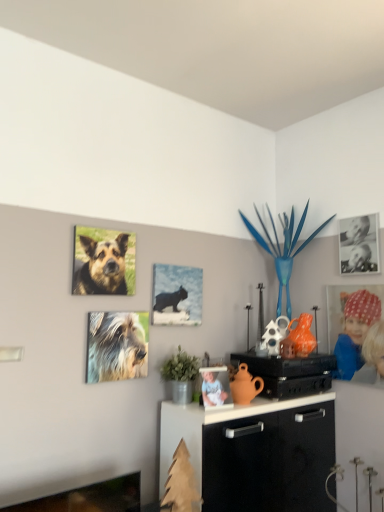
Find the location of a particular element. The height and width of the screenshot is (512, 384). brown fur dog at upper left, positioned as the second dog in bottom-to-top order is located at coordinates (102, 267).

How much space does brown fur dog at upper left, positioned as the second dog in bottom-to-top order, occupy vertically?

brown fur dog at upper left, positioned as the second dog in bottom-to-top order, is 12.17 inches tall.

What do you see at coordinates (289, 373) in the screenshot? I see `matte black speaker at center` at bounding box center [289, 373].

Measure the distance between point (187,306) and camera.

The depth of point (187,306) is 2.19 meters.

What do you see at coordinates (357, 332) in the screenshot? I see `polka dot fabric headband at right, positioned as the 1th person in back-to-front order` at bounding box center [357, 332].

This screenshot has height=512, width=384. In order to click on black paper photo at upper right, which ranks as the second picture frame in bottom-to-top order in this screenshot , I will do `click(359, 245)`.

Locate an element on the screen. This screenshot has width=384, height=512. brown fur dog at upper left, marked as the 1th dog in a top-to-bottom arrangement is located at coordinates (102, 267).

Is white porcelain figurine at center, the second person in the back-to-front sequence, far from metallic blue plant at upper center?

That's not correct — white porcelain figurine at center, the second person in the back-to-front sequence, is a little close to metallic blue plant at upper center.

Does point (203, 392) come farther from viewer compared to point (293, 255)?

No.

Consider the image. Considering the relative positions of white porcelain figurine at center, the first person from the left, and metallic blue plant at upper center in the image provided, is white porcelain figurine at center, the first person from the left, to the left or to the right of metallic blue plant at upper center?

white porcelain figurine at center, the first person from the left, is to the left of metallic blue plant at upper center.

From the image's perspective, is white porcelain figurine at center, the first person from the left, beneath metallic blue plant at upper center?

Yes.

Is point (241, 213) positioned behind point (284, 383)?

Yes, it is.

Which object is thinner, metallic blue plant at upper center or matte black speaker at center?

matte black speaker at center.

In terms of height, does metallic blue plant at upper center look taller or shorter compared to matte black speaker at center?

metallic blue plant at upper center is taller than matte black speaker at center.

From the picture: Is matte black cat at center, which is counted as the 1th picture frame, starting from the bottom, taller or shorter than black paper photo at upper right, marked as the first picture frame in a top-to-bottom arrangement?

In the image, matte black cat at center, which is counted as the 1th picture frame, starting from the bottom, appears to be shorter than black paper photo at upper right, marked as the first picture frame in a top-to-bottom arrangement.

Which is more to the left, matte black cat at center, which is the 2th picture frame in right-to-left order, or black paper photo at upper right, which ranks as the second picture frame in bottom-to-top order?

matte black cat at center, which is the 2th picture frame in right-to-left order, is more to the left.

Where is `picture frame above the matte black cat at center, positioned as the first picture frame in left-to-right order (from a real-world perspective)`? picture frame above the matte black cat at center, positioned as the first picture frame in left-to-right order (from a real-world perspective) is located at coordinates (359, 245).

Considering the relative positions of matte black speaker at center and fuzzy fur dog at upper left, the 1th dog positioned from the bottom, in the image provided, is matte black speaker at center in front of fuzzy fur dog at upper left, the 1th dog positioned from the bottom,?

No.

In terms of width, does matte black speaker at center look wider or thinner when compared to fuzzy fur dog at upper left, the 1th dog positioned from the bottom?

Considering their sizes, matte black speaker at center looks broader than fuzzy fur dog at upper left, the 1th dog positioned from the bottom.

From a real-world perspective, is matte black speaker at center positioned under fuzzy fur dog at upper left, the 1th dog positioned from the bottom, based on gravity?

Yes, from a real-world perspective, matte black speaker at center is below fuzzy fur dog at upper left, the 1th dog positioned from the bottom.

Based on the photo, from a real-world perspective, which object stands above the other?

fuzzy fur dog at upper left, the 2th dog positioned from the top, from a real-world perspective.

Between fuzzy fur dog at upper left, the 1th dog positioned from the bottom, and white porcelain figurine at center, the 1th person in the front-to-back sequence, which one appears on the right side from the viewer's perspective?

Positioned to the right is white porcelain figurine at center, the 1th person in the front-to-back sequence.

Does fuzzy fur dog at upper left, the 2th dog positioned from the top, come behind white porcelain figurine at center, the second person in the back-to-front sequence?

No.

Which point is more distant from viewer, (94, 286) or (208, 400)?

The point (94, 286) is farther.

You are a GUI agent. You are given a task and a screenshot of the screen. Output one action in this format:
    pyautogui.click(x=<x>, y=<y>)
    Task: Click on the person that is the 2nd one below the brown fur dog at upper left, positioned as the second dog in bottom-to-top order (from a real-world perspective)
    This screenshot has width=384, height=512.
    Given the screenshot: What is the action you would take?
    pyautogui.click(x=212, y=389)

In terms of width, does brown fur dog at upper left, marked as the 1th dog in a top-to-bottom arrangement, look wider or thinner when compared to white porcelain figurine at center, the 1th person in the front-to-back sequence?

brown fur dog at upper left, marked as the 1th dog in a top-to-bottom arrangement, is thinner than white porcelain figurine at center, the 1th person in the front-to-back sequence.

Can white porcelain figurine at center, the second person in the back-to-front sequence, be found inside brown fur dog at upper left, marked as the 1th dog in a top-to-bottom arrangement?

No, white porcelain figurine at center, the second person in the back-to-front sequence, is located outside of brown fur dog at upper left, marked as the 1th dog in a top-to-bottom arrangement.

Who is shorter, polka dot fabric headband at right, positioned as the 1th person in back-to-front order, or black paper photo at upper right, which ranks as the second picture frame in bottom-to-top order?

With less height is black paper photo at upper right, which ranks as the second picture frame in bottom-to-top order.

Is polka dot fabric headband at right, which is the first person in right-to-left order, facing away from black paper photo at upper right, which ranks as the second picture frame in bottom-to-top order?

polka dot fabric headband at right, which is the first person in right-to-left order, does not have its back to black paper photo at upper right, which ranks as the second picture frame in bottom-to-top order.

What are the coordinates of `person that is the 1st one when counting leftward from the black paper photo at upper right, which ranks as the second picture frame in bottom-to-top order` in the screenshot? It's located at (357, 332).

Between polka dot fabric headband at right, positioned as the 1th person in back-to-front order, and black paper photo at upper right, which is the first picture frame from right to left, which one has larger width?

With larger width is polka dot fabric headband at right, positioned as the 1th person in back-to-front order.

There is a metallic blue plant at upper center. Identify the location of the 2nd person below it (from a real-world perspective). The width and height of the screenshot is (384, 512). (212, 389).

Where is `appliance below the metallic blue plant at upper center (from the image's perspective)`? The image size is (384, 512). appliance below the metallic blue plant at upper center (from the image's perspective) is located at coordinates (289, 373).

When comparing their distances from matte black cat at center, which is the 2th picture frame in right-to-left order, does fuzzy fur dog at upper left, the 2th dog positioned from the top, or brown fur dog at upper left, marked as the 1th dog in a top-to-bottom arrangement, seem further?

brown fur dog at upper left, marked as the 1th dog in a top-to-bottom arrangement, lies further to matte black cat at center, which is the 2th picture frame in right-to-left order, than the other object.

Estimate the real-world distances between objects in this image. Which object is further from metallic blue plant at upper center, matte black cat at center, which is counted as the 1th picture frame, starting from the bottom, or white porcelain figurine at center, the 1th person in the front-to-back sequence?

white porcelain figurine at center, the 1th person in the front-to-back sequence, is positioned further to the anchor metallic blue plant at upper center.

Looking at the image, which one is located further to fuzzy fur dog at upper left, the 1th dog positioned from the bottom, matte black speaker at center or matte black cat at center, which appears as the second picture frame when viewed from the top?

matte black speaker at center is further to fuzzy fur dog at upper left, the 1th dog positioned from the bottom.

Which object lies nearer to the anchor point matte black cat at center, which appears as the second picture frame when viewed from the top, metallic blue plant at upper center or brown fur dog at upper left, marked as the 1th dog in a top-to-bottom arrangement?

brown fur dog at upper left, marked as the 1th dog in a top-to-bottom arrangement.

Considering their positions, is matte black speaker at center positioned further to brown fur dog at upper left, marked as the 1th dog in a top-to-bottom arrangement, than matte black cat at center, which appears as the second picture frame when viewed from the top?

matte black speaker at center is positioned further to the anchor brown fur dog at upper left, marked as the 1th dog in a top-to-bottom arrangement.

From the image, which object appears to be farther from fuzzy fur dog at upper left, the 2th dog positioned from the top, brown fur dog at upper left, marked as the 1th dog in a top-to-bottom arrangement, or white porcelain figurine at center, the second person in the back-to-front sequence?

Among the two, white porcelain figurine at center, the second person in the back-to-front sequence, is located further to fuzzy fur dog at upper left, the 2th dog positioned from the top.

Considering their positions, is brown fur dog at upper left, positioned as the second dog in bottom-to-top order, positioned further to matte black speaker at center than metallic blue plant at upper center?

brown fur dog at upper left, positioned as the second dog in bottom-to-top order, is further to matte black speaker at center.

Looking at the image, which one is located closer to brown fur dog at upper left, positioned as the second dog in bottom-to-top order, white porcelain figurine at center, the first person from the left, or fuzzy fur dog at upper left, the 2th dog positioned from the top?

fuzzy fur dog at upper left, the 2th dog positioned from the top, is positioned closer to the anchor brown fur dog at upper left, positioned as the second dog in bottom-to-top order.

At what (x,y) coordinates should I click in order to perform the action: click on picture frame between brown fur dog at upper left, positioned as the second dog in bottom-to-top order, and matte black speaker at center. Please return your answer as a coordinate pair (x, y). Image resolution: width=384 pixels, height=512 pixels. Looking at the image, I should click on (177, 295).

Identify the location of picture frame between fuzzy fur dog at upper left, the 1th dog positioned from the bottom, and metallic blue plant at upper center, in the horizontal direction. (177, 295).

Image resolution: width=384 pixels, height=512 pixels. What are the coordinates of `picture frame between brown fur dog at upper left, marked as the 1th dog in a top-to-bottom arrangement, and polka dot fabric headband at right, which is the first person in right-to-left order` in the screenshot? It's located at (177, 295).

Identify the location of toy between brown fur dog at upper left, positioned as the second dog in bottom-to-top order, and polka dot fabric headband at right, acting as the 2th person starting from the left, from left to right. Image resolution: width=384 pixels, height=512 pixels. (283, 248).